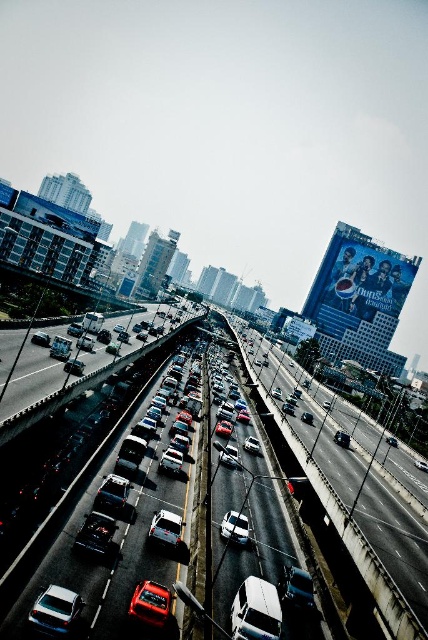
Which is behind, point (366, 580) or point (53, 355)?

The point (53, 355) is more distant.

Who is shorter, white glossy car at center or matte black car at center?

matte black car at center

The height and width of the screenshot is (640, 428). In order to click on white glossy car at center in this screenshot , I will do `click(344, 525)`.

Is point (53, 602) behind point (51, 352)?

No.

Who is more forward, (65, 602) or (65, 349)?

Point (65, 602)

Find the location of a particular element. The image size is (428, 640). matte white car at lower left is located at coordinates (56, 611).

Identify the location of matte white car at lower left. The width and height of the screenshot is (428, 640). pos(56,611).

Between point (323, 490) and point (246, 541), which one is positioned behind?

The point (323, 490) is behind.

Is point (359, 548) closer to camera compared to point (246, 518)?

Yes.

The height and width of the screenshot is (640, 428). Find the location of `white glossy car at center`. white glossy car at center is located at coordinates (344, 525).